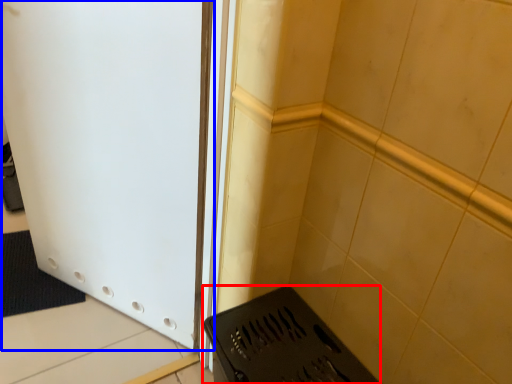
Question: Which object appears farthest to the camera in this image, appliance (highlighted by a red box) or door (highlighted by a blue box)?

Choices:
 (A) appliance
 (B) door

Answer: (A)